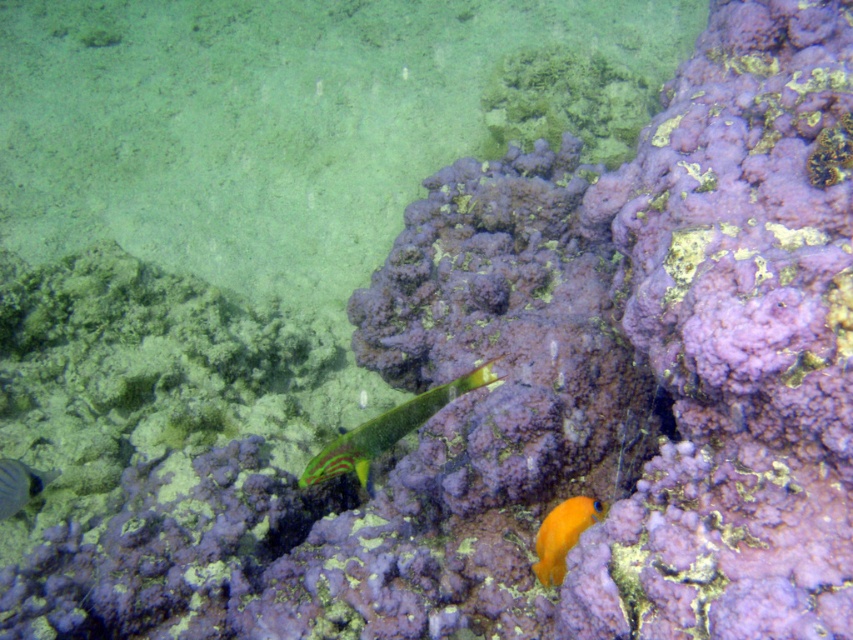
In the scene shown: You are a marine biologist observing the underwater scene. You need to determine which fish is wider between the orange matte fish at lower right and the shiny silver fish at lower left. Which one is wider?

The orange matte fish at lower right is wider than the shiny silver fish at lower left according to the description.

You are a marine biologist observing an underwater scene. You notice two fish in the image. The first is a green glossy fish at center, and the second is an orange matte fish at lower right. Based on their positions, which fish is closer to the left side of the image?

The green glossy fish at center is to the left of the orange matte fish at lower right, so the green glossy fish at center is closer to the left side of the image.